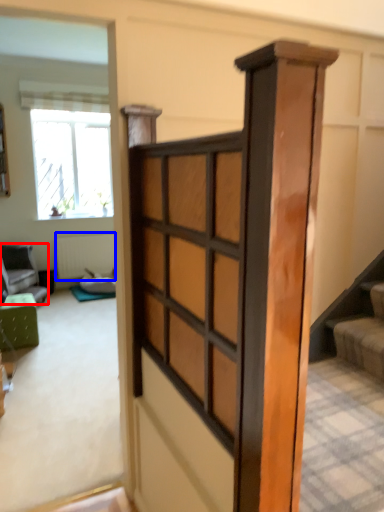
Question: Which point is further to the camera, furniture (highlighted by a red box) or radiator (highlighted by a blue box)?

Choices:
 (A) furniture
 (B) radiator

Answer: (B)